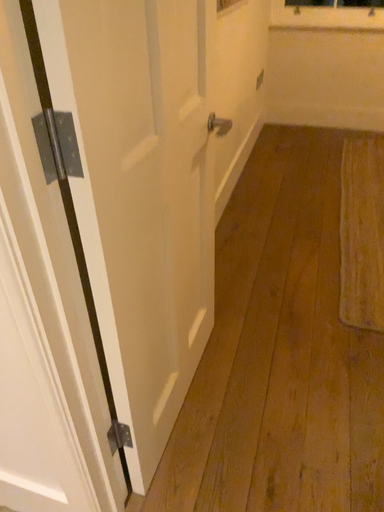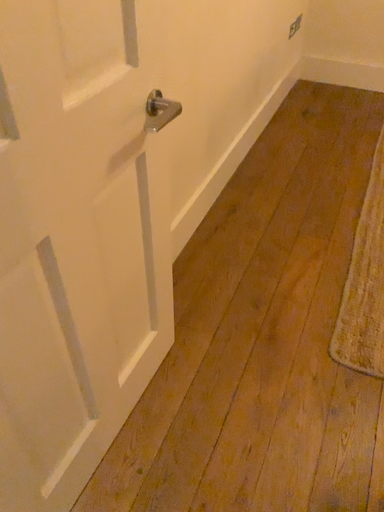
Question: Which way did the camera rotate in the video?

Choices:
 (A) rotated upward
 (B) rotated downward

Answer: (B)